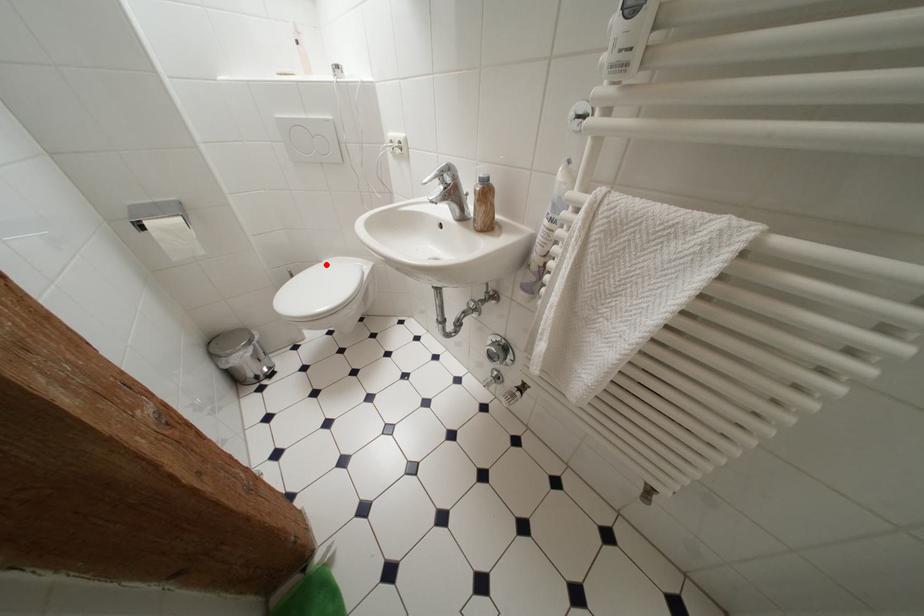
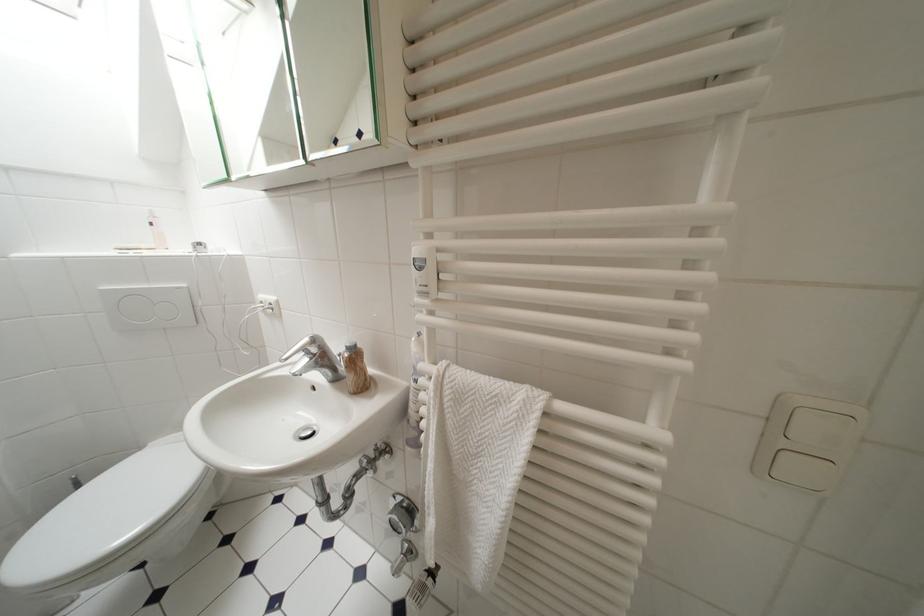
Question: I am providing you with two images of the same scene from different viewpoints. Image1 has a red point marked. In image2, the corresponding 3D location appears at what relative position? Reply with the corresponding letter.

Choices:
 (A) Closer
 (B) Farther

Answer: (A)